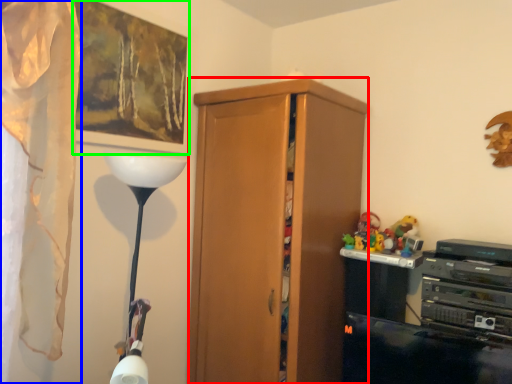
Question: Which object is positioned farthest from cabinetry (highlighted by a red box)? Select from curtain (highlighted by a blue box) and picture frame (highlighted by a green box).

Choices:
 (A) curtain
 (B) picture frame

Answer: (A)